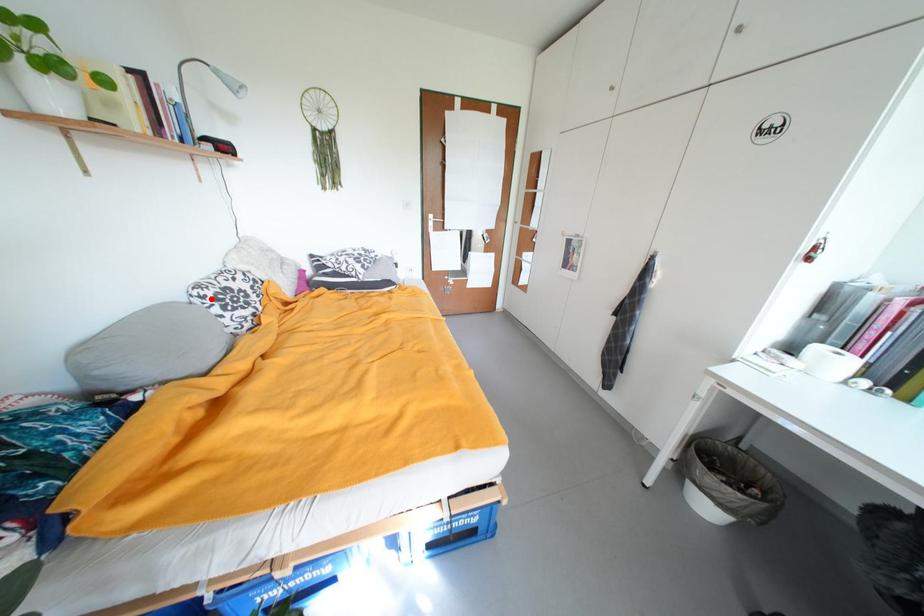
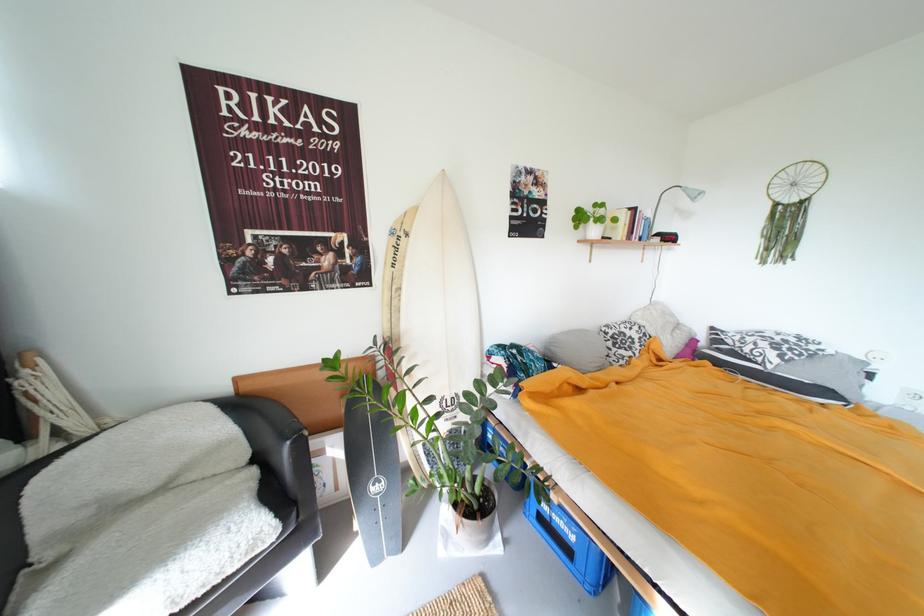
Question: I am providing you with two images of the same scene from different viewpoints. In image1, a red point is highlighted. Considering the same 3D point in image2, which of the following is correct?

Choices:
 (A) It is closer
 (B) It is farther

Answer: (B)